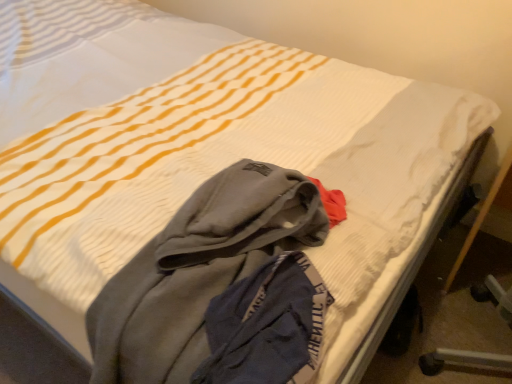
Question: Is gray fleece hoodie at center taller or shorter than wooden bed frame at lower right?

Choices:
 (A) tall
 (B) short

Answer: (B)

Question: From the image's perspective, relative to wooden bed frame at lower right, is gray fleece hoodie at center above or below?

Choices:
 (A) above
 (B) below

Answer: (B)

Question: Looking at the image, does gray fleece hoodie at center seem bigger or smaller compared to wooden bed frame at lower right?

Choices:
 (A) big
 (B) small

Answer: (B)

Question: From the image's perspective, is wooden bed frame at lower right located above or below gray fleece hoodie at center?

Choices:
 (A) below
 (B) above

Answer: (B)

Question: From a real-world perspective, is wooden bed frame at lower right physically located above or below gray fleece hoodie at center?

Choices:
 (A) below
 (B) above

Answer: (A)

Question: Is point (351, 360) closer or farther from the camera than point (124, 292)?

Choices:
 (A) farther
 (B) closer

Answer: (A)

Question: Would you say wooden bed frame at lower right is inside or outside gray fleece hoodie at center?

Choices:
 (A) inside
 (B) outside

Answer: (B)